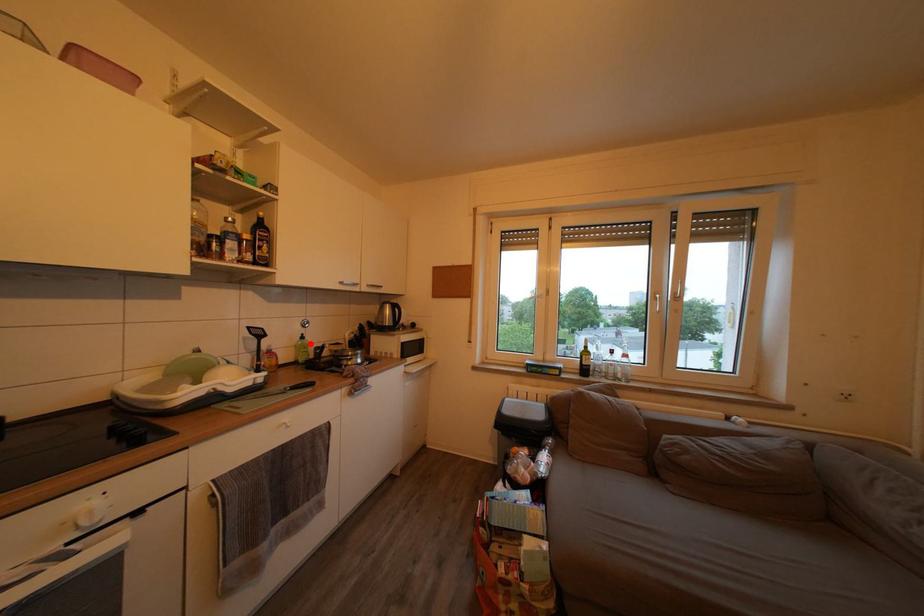
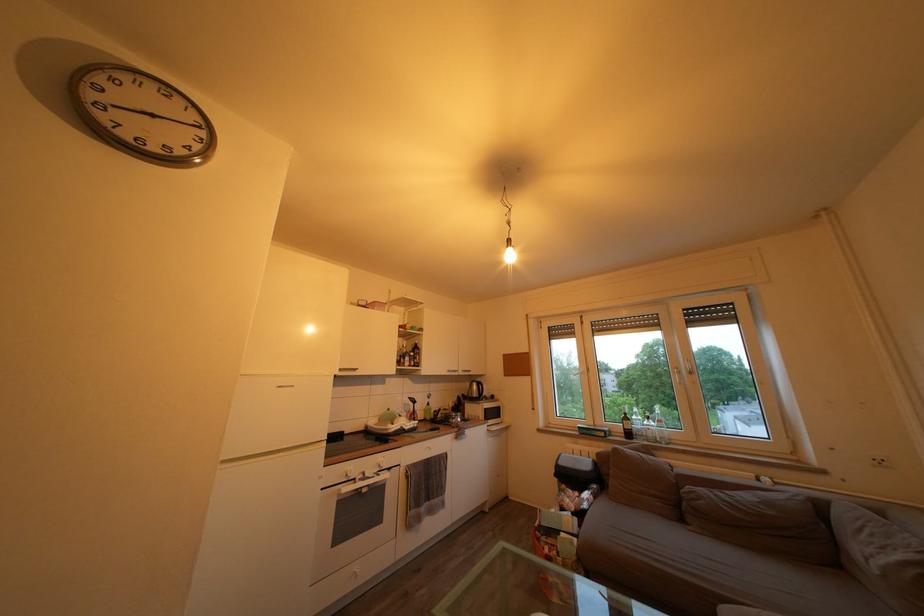
Question: I am providing you with two images of the same scene from different viewpoints. In image1, a red point is highlighted. Considering the same 3D point in image2, which of the following is correct?

Choices:
 (A) It is closer
 (B) It is farther

Answer: (B)